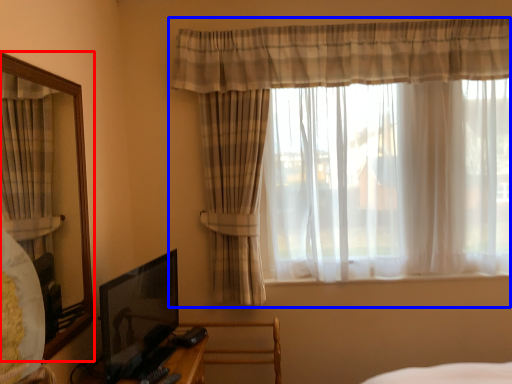
Question: Which of the following is the closest to the observer, mirror (highlighted by a red box) or curtain (highlighted by a blue box)?

Choices:
 (A) mirror
 (B) curtain

Answer: (A)